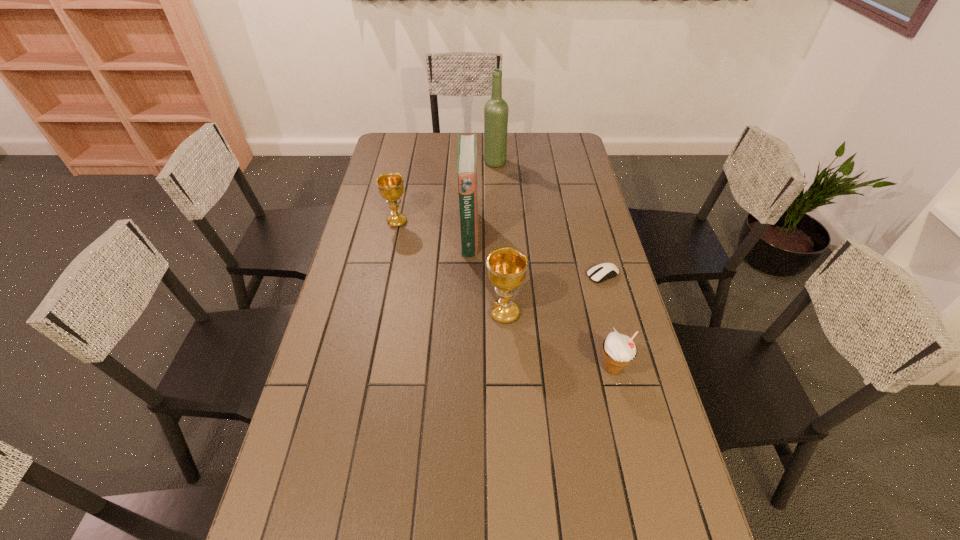
The image size is (960, 540). Find the location of `blank space that satisfies the following two spatial constraints: 1. on the cover of the fifth shortest object; 2. on the back side of the fourth farthest object`. blank space that satisfies the following two spatial constraints: 1. on the cover of the fifth shortest object; 2. on the back side of the fourth farthest object is located at coordinates (468, 275).